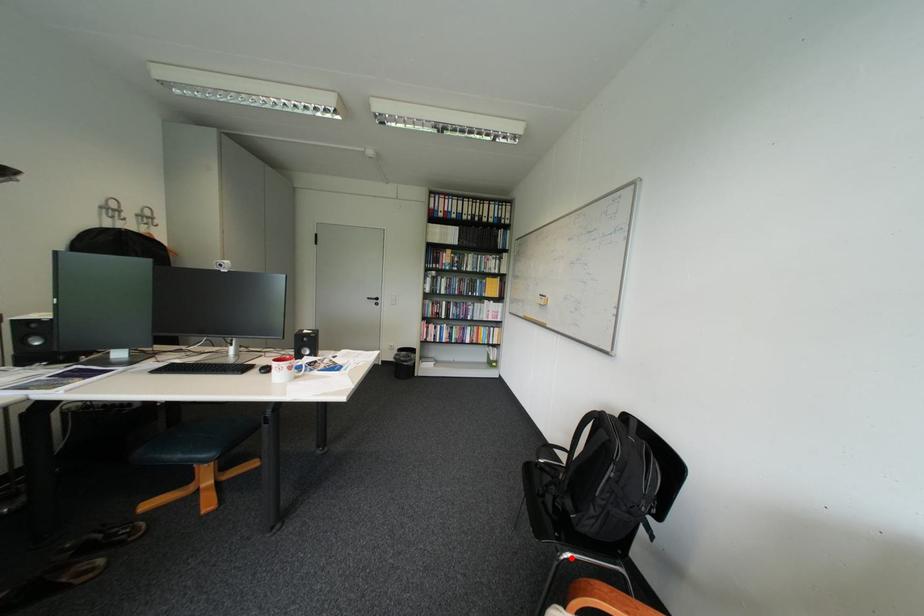
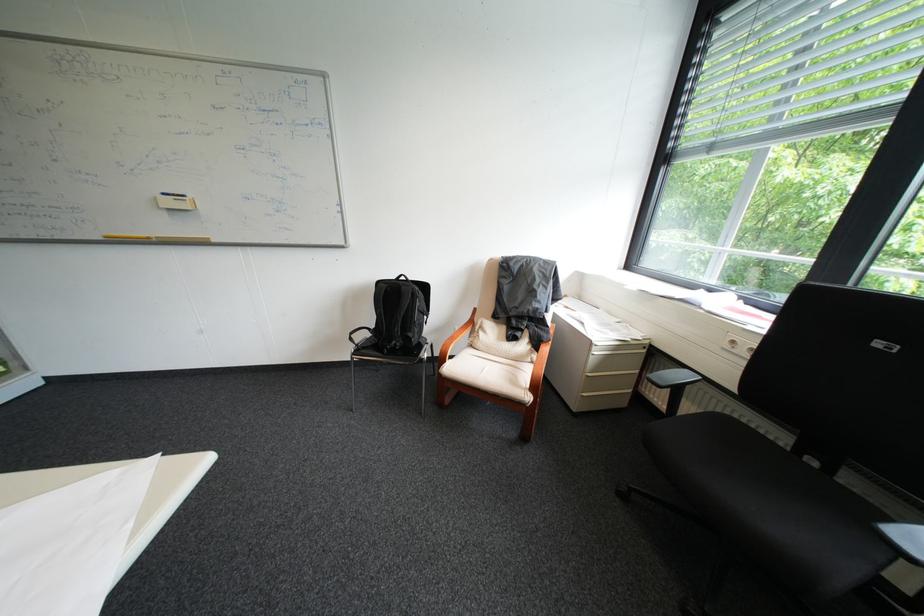
Where in the second image is the point corresponding to the highlighted location from the first image?

(436, 358)